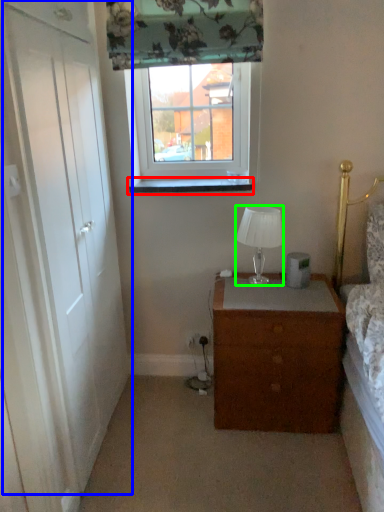
Question: Based on their relative distances, which object is nearer to window sill (highlighted by a red box)? Choose from door (highlighted by a blue box) and lamp (highlighted by a green box).

Choices:
 (A) door
 (B) lamp

Answer: (B)